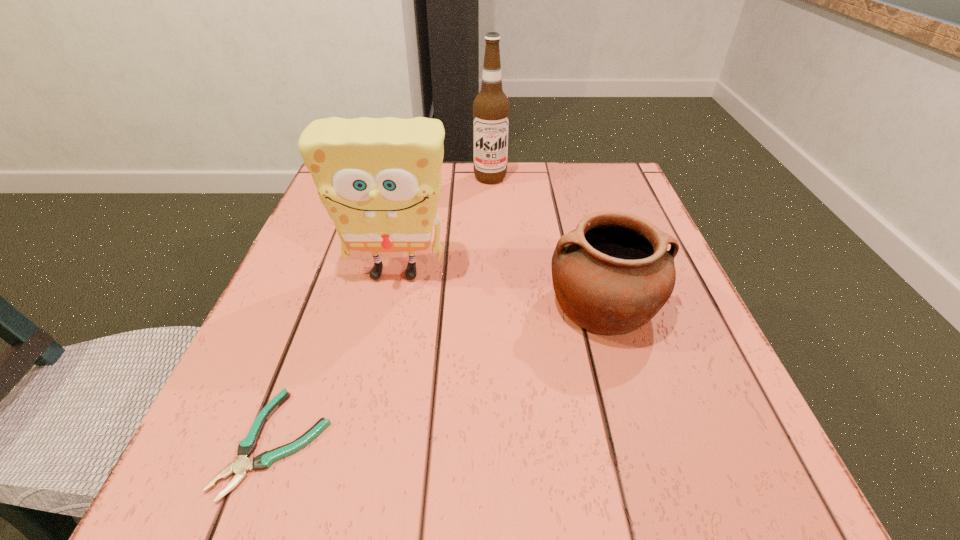
Identify the location of alcohol. (491, 107).

The width and height of the screenshot is (960, 540). Identify the location of the second object from right to left. (491, 107).

Where is `the third shortest object`? This screenshot has height=540, width=960. the third shortest object is located at coordinates (379, 179).

Find the location of a particular element. The image size is (960, 540). the third tallest object is located at coordinates (611, 275).

This screenshot has height=540, width=960. What are the coordinates of `pottery` in the screenshot? It's located at (611, 275).

You are a GUI agent. You are given a task and a screenshot of the screen. Output one action in this format:
    pyautogui.click(x=<x>, y=<y>)
    Task: Click on the nearest object
    This screenshot has height=540, width=960.
    Given the screenshot: What is the action you would take?
    pyautogui.click(x=242, y=465)

I want to click on pliers, so click(242, 465).

Locate an element on the screen. Image resolution: width=960 pixels, height=540 pixels. blank space located 0.300m on the label of the second object from right to left is located at coordinates (493, 265).

Identify the location of vacant space located 0.120m on the face of the sponge. (379, 346).

At what (x,y) coordinates should I click in order to perform the action: click on vacant space located 0.090m on the front of the rightmost object. Please return your answer as a coordinate pair (x, y). The image size is (960, 540). Looking at the image, I should click on (630, 396).